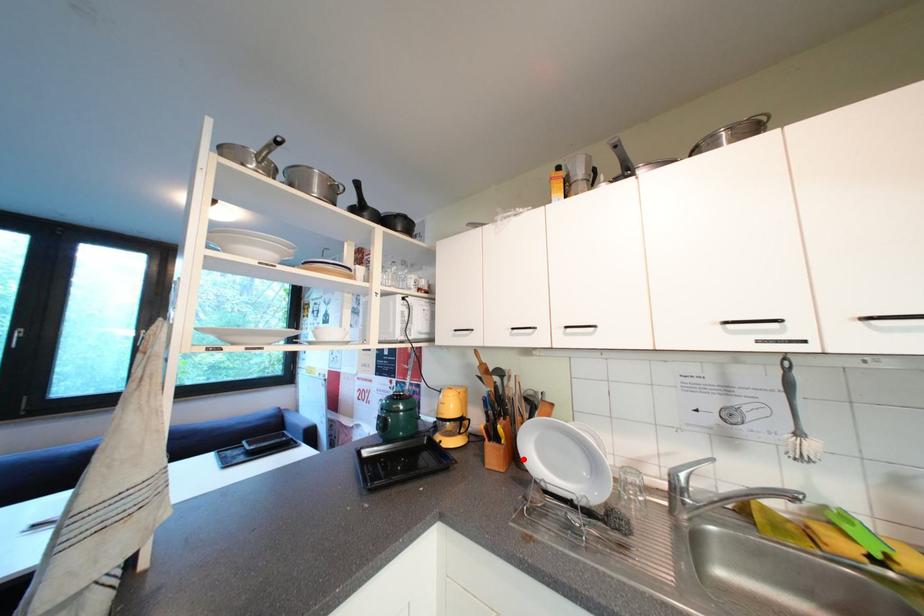
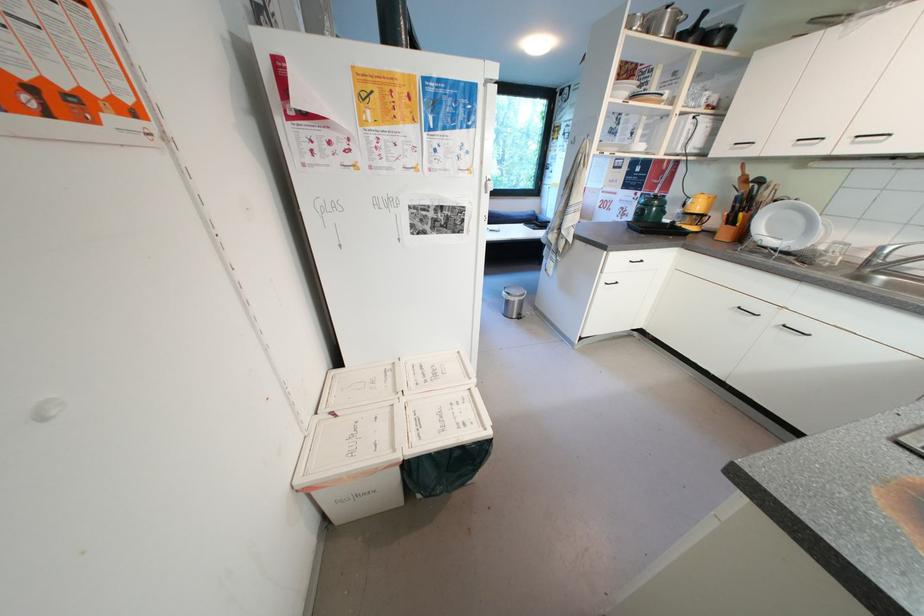
Question: I am providing you with two images of the same scene from different viewpoints. A red point is marked on the first image. Is the red point's position out of view in image 2?

Choices:
 (A) Yes
 (B) No

Answer: (B)